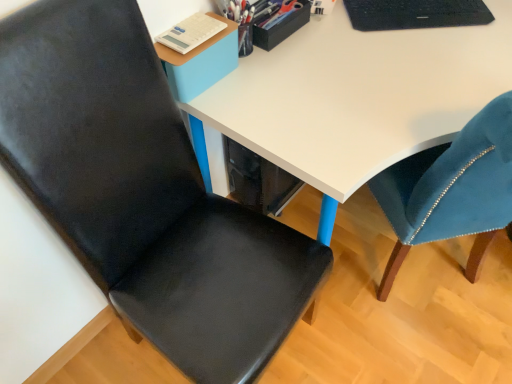
Find the location of a particular element. The image size is (512, 384). free space in front of metallic pen holder at upper center is located at coordinates (289, 66).